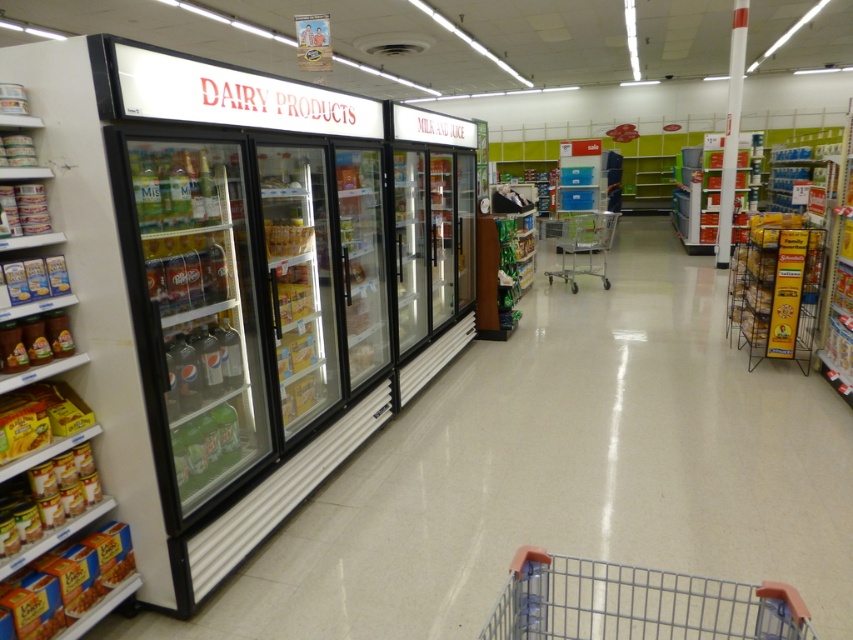
Can you confirm if white plastic shelves at left is shorter than shiny brown jar at lower left?

No, white plastic shelves at left is not shorter than shiny brown jar at lower left.

The width and height of the screenshot is (853, 640). Describe the element at coordinates (61, 120) in the screenshot. I see `white plastic shelves at left` at that location.

Does point (90, 77) come in front of point (32, 321)?

Yes, point (90, 77) is closer to viewer.

Identify the location of white plastic shelves at left. This screenshot has width=853, height=640. (61, 120).

Consider the image. Does metallic silver shopping cart at center have a lesser height compared to translucent plastic juice at center?

No.

Does metallic silver shopping cart at center appear under translucent plastic juice at center?

Incorrect, metallic silver shopping cart at center is not positioned below translucent plastic juice at center.

Who is more distant from viewer, (583, 216) or (281, 230)?

The point (583, 216) is more distant.

Locate an element on the screen. This screenshot has width=853, height=640. metallic silver shopping cart at center is located at coordinates (581, 244).

Is white plastic shelves at left above translucent plastic juice at center?

No.

Which is more to the right, white plastic shelves at left or translucent plastic juice at center?

Positioned to the right is translucent plastic juice at center.

Does point (0, 300) come closer to viewer compared to point (276, 234)?

That is True.

Image resolution: width=853 pixels, height=640 pixels. What are the coordinates of `white plastic shelves at left` in the screenshot? It's located at (61, 120).